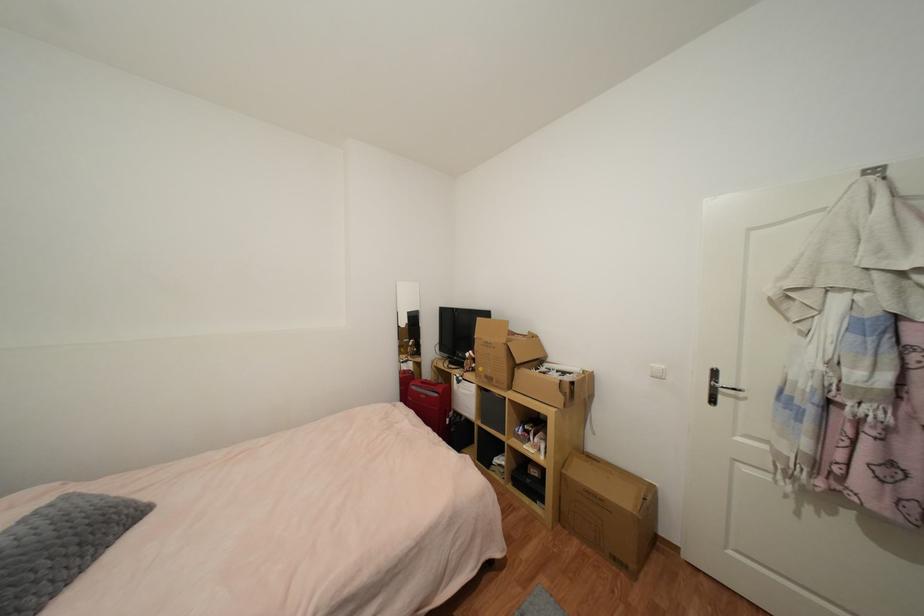
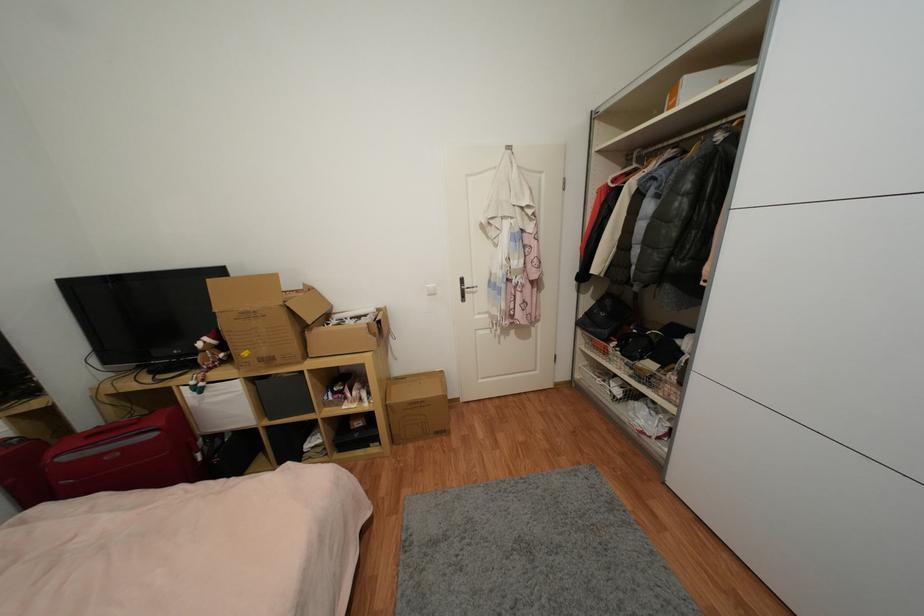
Where in the second image is the point corresponding to the point at 494,381 from the first image?

(274, 361)